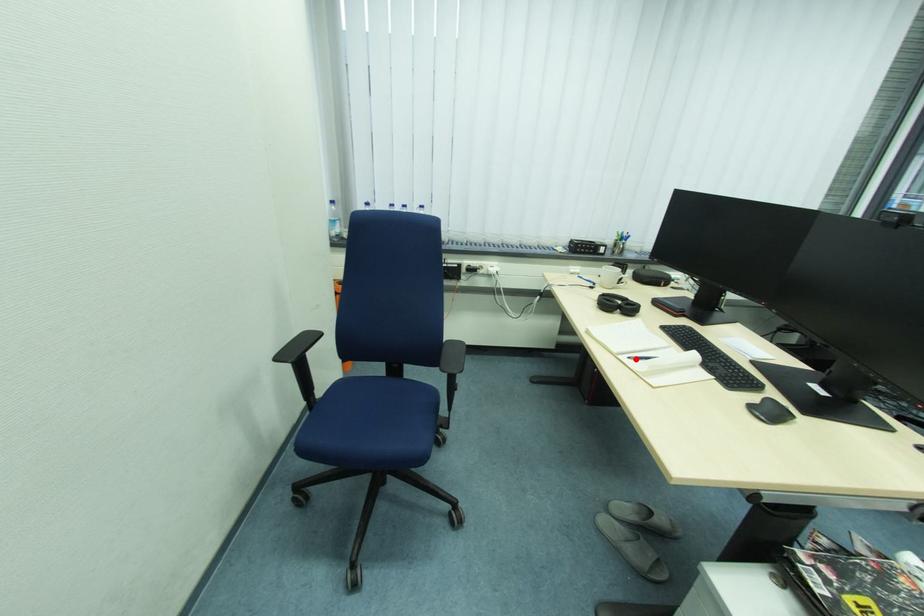
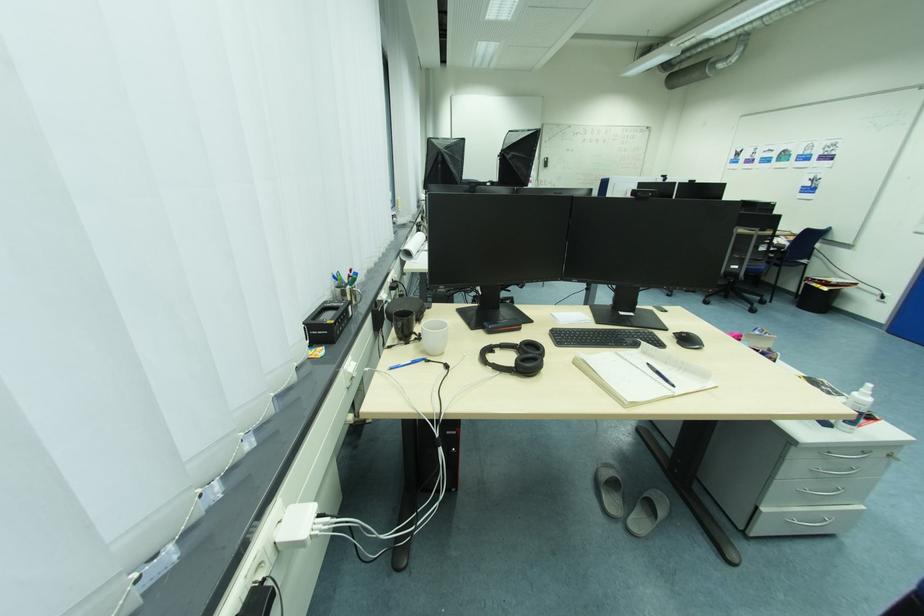
The point at the highlighted location is marked in the first image. Where is the corresponding point in the second image?

(681, 387)